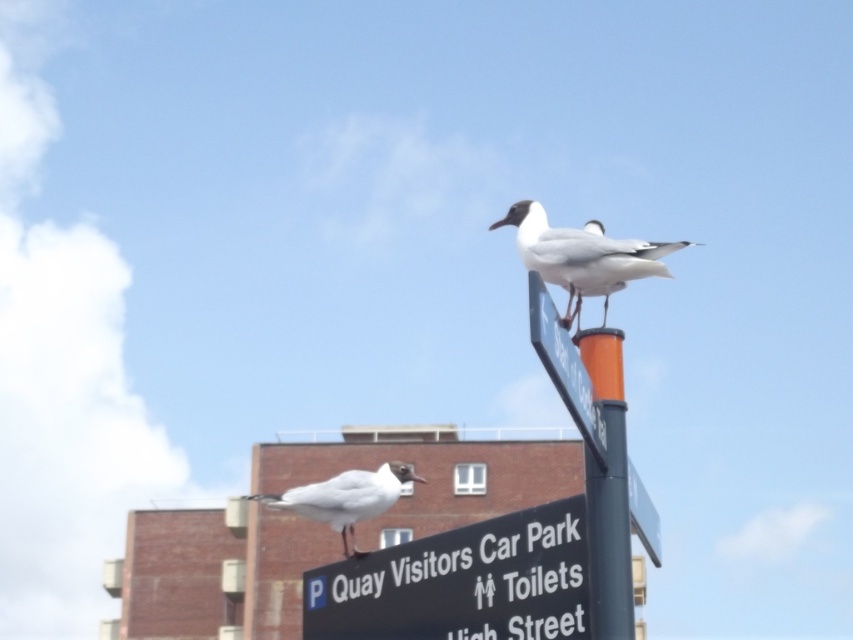
Between point (376, 632) and point (642, 262), which one is positioned behind?

The point (642, 262) is more distant.

This screenshot has width=853, height=640. I want to click on black plastic sign at lower center, so click(461, 582).

Is black plastic sign at lower center thinner than white matte bird at center?

Incorrect, black plastic sign at lower center's width is not less than white matte bird at center's.

Does point (338, 596) come farther from viewer compared to point (280, 493)?

No.

Which is behind, point (463, 580) or point (364, 492)?

Point (364, 492)

Locate an element on the screen. The image size is (853, 640). black plastic sign at lower center is located at coordinates (461, 582).

Which of these two, white matte bird at upper center or metallic blue signpost at upper center, stands shorter?

white matte bird at upper center is shorter.

The width and height of the screenshot is (853, 640). What do you see at coordinates (582, 256) in the screenshot? I see `white matte bird at upper center` at bounding box center [582, 256].

Between point (625, 275) and point (555, 376), which one is positioned in front?

Point (555, 376) is more forward.

Identify the location of white matte bird at upper center. The height and width of the screenshot is (640, 853). (582, 256).